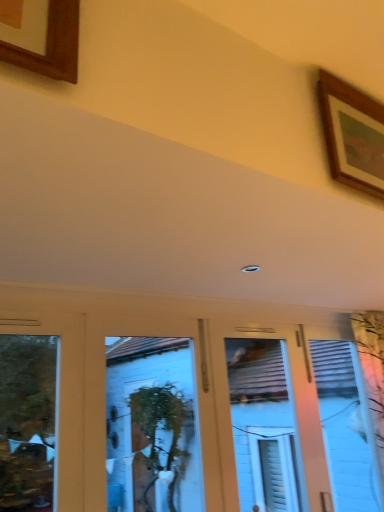
Measure the distance between wooden picture frame at upper right and camera.

1.24 meters.

What do you see at coordinates (352, 134) in the screenshot?
I see `wooden picture frame at upper right` at bounding box center [352, 134].

I want to click on wooden picture frame at upper right, so pyautogui.click(x=352, y=134).

What is the approximate width of wooden picture frame at upper right?

It is 2.76 inches.

This screenshot has width=384, height=512. What do you see at coordinates (195, 373) in the screenshot?
I see `white glossy door at center` at bounding box center [195, 373].

What is the approximate height of white glossy door at center?

3.90 feet.

Identify the location of white glossy door at center. (195, 373).

Find the location of a particular element. The image size is (384, 512). wooden picture frame at upper right is located at coordinates (352, 134).

Which object is positioned more to the right, white glossy door at center or wooden picture frame at upper right?

wooden picture frame at upper right.

From the picture: Which is in front, white glossy door at center or wooden picture frame at upper right?

wooden picture frame at upper right is in front.

Does point (317, 461) appear closer or farther from the camera than point (354, 142)?

Clearly, point (317, 461) is more distant from the camera than point (354, 142).

From the image's perspective, which one is positioned higher, white glossy door at center or wooden picture frame at upper right?

wooden picture frame at upper right.

From a real-world perspective, between white glossy door at center and wooden picture frame at upper right, who is vertically lower?

white glossy door at center, from a real-world perspective.

Which of these two, white glossy door at center or wooden picture frame at upper right, is wider?

With larger width is white glossy door at center.

Considering the sizes of objects white glossy door at center and wooden picture frame at upper right in the image provided, who is shorter, white glossy door at center or wooden picture frame at upper right?

Standing shorter between the two is wooden picture frame at upper right.

Which of these two, white glossy door at center or wooden picture frame at upper right, is bigger?

With larger size is white glossy door at center.

Would you say white glossy door at center is outside wooden picture frame at upper right?

Yes, white glossy door at center is outside of wooden picture frame at upper right.

Is there a large distance between white glossy door at center and wooden picture frame at upper right?

white glossy door at center is far away from wooden picture frame at upper right.

Could you tell me if white glossy door at center is turned towards wooden picture frame at upper right?

Yes, white glossy door at center is aimed at wooden picture frame at upper right.

I want to click on picture frame in front of the white glossy door at center, so click(352, 134).

In the scene shown: Does wooden picture frame at upper right appear on the left side of white glossy door at center?

No, wooden picture frame at upper right is not to the left of white glossy door at center.

Which object is closer to the camera taking this photo, wooden picture frame at upper right or white glossy door at center?

wooden picture frame at upper right.

Does point (349, 168) appear closer or farther from the camera than point (341, 314)?

Clearly, point (349, 168) is closer to the camera than point (341, 314).

From the image's perspective, is wooden picture frame at upper right located above or below white glossy door at center?

wooden picture frame at upper right is situated higher than white glossy door at center in the image.

From a real-world perspective, does wooden picture frame at upper right sit lower than white glossy door at center?

No, from a real-world perspective, wooden picture frame at upper right is not below white glossy door at center.

Between wooden picture frame at upper right and white glossy door at center, which one has larger width?

white glossy door at center.

Between wooden picture frame at upper right and white glossy door at center, which one has more height?

Standing taller between the two is white glossy door at center.

Looking at the image, does wooden picture frame at upper right seem bigger or smaller compared to white glossy door at center?

Considering their sizes, wooden picture frame at upper right takes up less space than white glossy door at center.

Is white glossy door at center a part of wooden picture frame at upper right?

No, white glossy door at center is not surrounded by wooden picture frame at upper right.

Is wooden picture frame at upper right far from white glossy door at center?

wooden picture frame at upper right is far away from white glossy door at center.

Does wooden picture frame at upper right turn towards white glossy door at center?

No, wooden picture frame at upper right is not oriented towards white glossy door at center.

Based on the photo, how many degrees apart are the facing directions of wooden picture frame at upper right and white glossy door at center?

wooden picture frame at upper right and white glossy door at center are facing 0.06 degrees away from each other.

The image size is (384, 512). Find the location of `hotel lobby located on the left of wooden picture frame at upper right`. hotel lobby located on the left of wooden picture frame at upper right is located at coordinates (195, 373).

Locate an element on the screen. This screenshot has height=512, width=384. picture frame in front of the white glossy door at center is located at coordinates (352, 134).

Where is `picture frame that is on the right side of white glossy door at center`? Image resolution: width=384 pixels, height=512 pixels. picture frame that is on the right side of white glossy door at center is located at coordinates (352, 134).